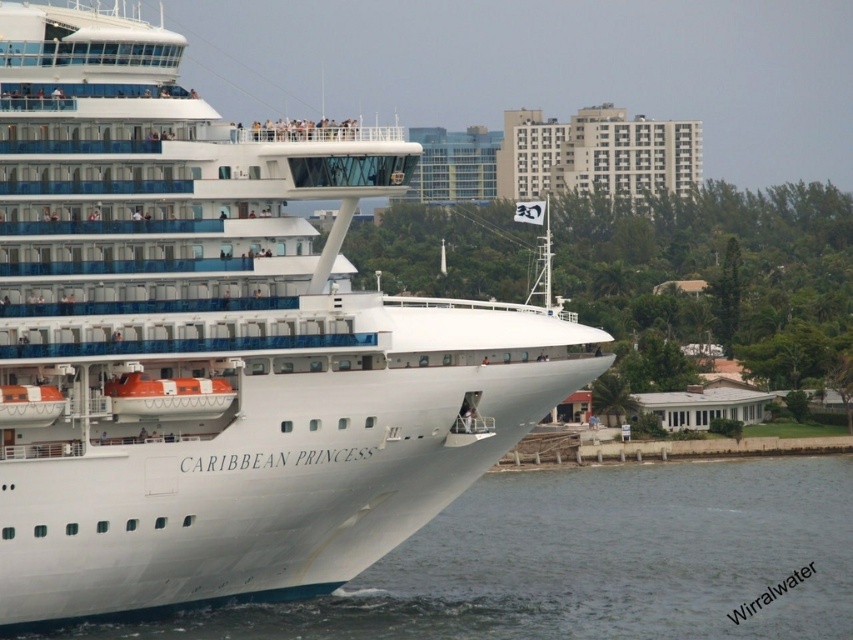
Question: Which object appears farthest from the camera in this image?

Choices:
 (A) white water at lower left
 (B) white glossy cruise ship at center

Answer: (A)

Question: Is white glossy cruise ship at center above white water at lower left?

Choices:
 (A) no
 (B) yes

Answer: (B)

Question: Observing the image, what is the correct spatial positioning of white glossy cruise ship at center in reference to white water at lower left?

Choices:
 (A) left
 (B) right

Answer: (A)

Question: From the image, what is the correct spatial relationship of white glossy cruise ship at center in relation to white water at lower left?

Choices:
 (A) right
 (B) left

Answer: (B)